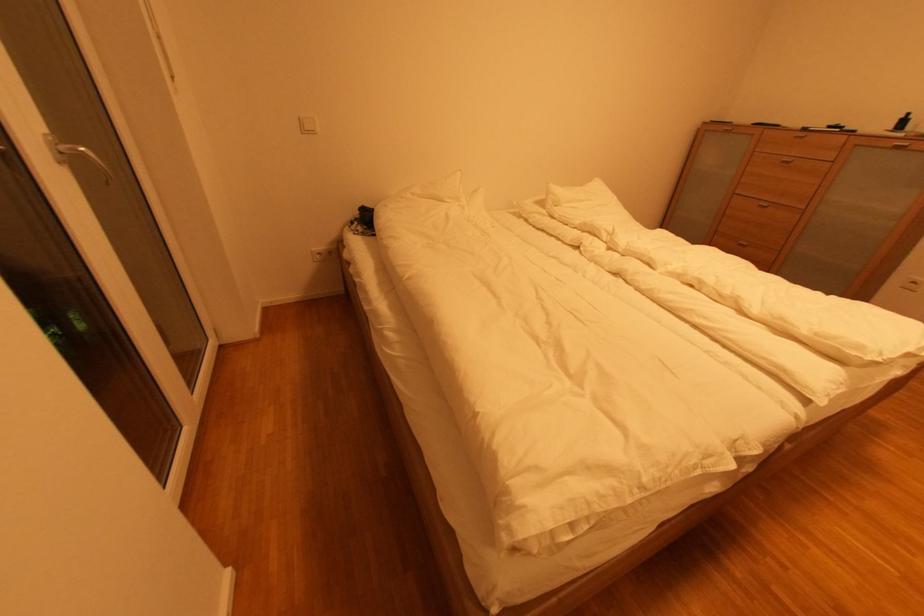
Where would you press the white light switch? Please return your answer as a coordinate pair (x, y).

(308, 124)